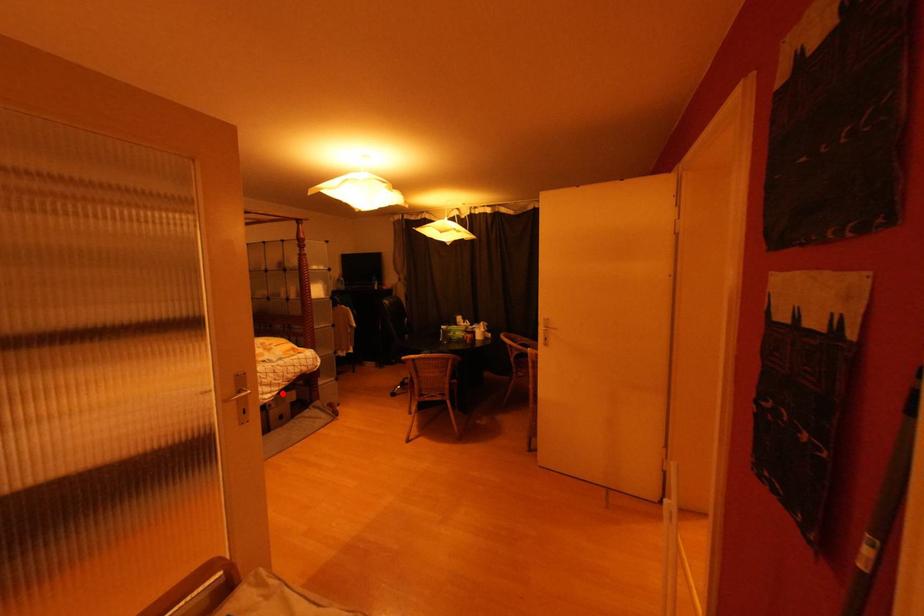
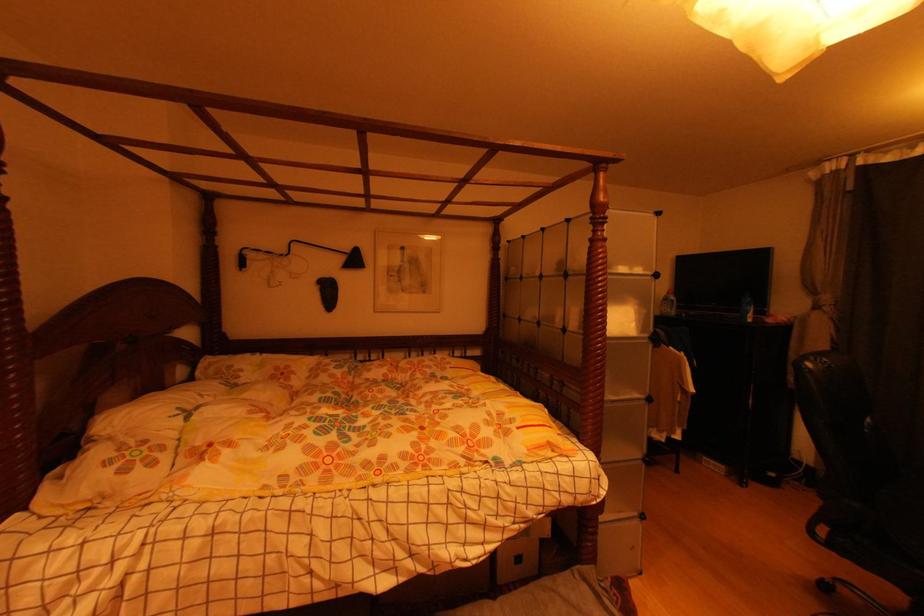
Where in the second image is the point corresponding to the highlighted location from the first image?

(504, 545)